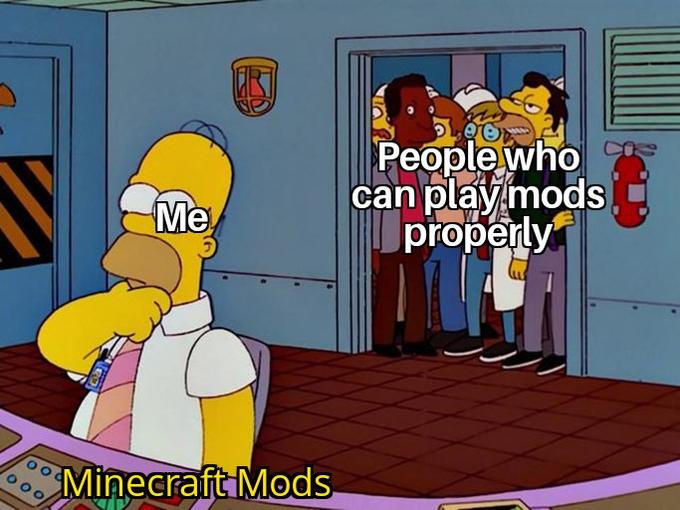
The width and height of the screenshot is (680, 510). What are the coordinates of `brown floor` in the screenshot? It's located at (485, 428), (54, 399).